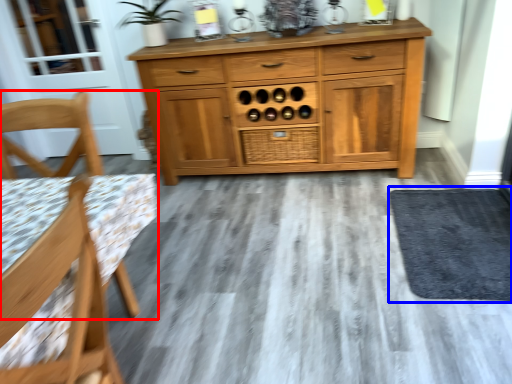
Question: Which object is closer to the camera taking this photo, chair (highlighted by a red box) or door (highlighted by a blue box)?

Choices:
 (A) chair
 (B) door

Answer: (A)